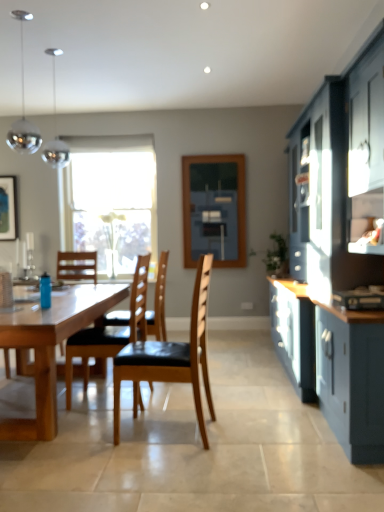
Question: Is brown leather chair at center, positioned as the 3th chair in back-to-front order, further to camera compared to wooden chair with black seat cushion at center, which is the third chair in front-to-back order?

Choices:
 (A) no
 (B) yes

Answer: (A)

Question: Is brown leather chair at center, which is the first chair in front-to-back order, not inside wooden chair with black seat cushion at center, which is the third chair in front-to-back order?

Choices:
 (A) no
 (B) yes

Answer: (B)

Question: From the image's perspective, would you say brown leather chair at center, positioned as the 3th chair in back-to-front order, is shown under wooden chair with black seat cushion at center, the 1th chair from the back?

Choices:
 (A) yes
 (B) no

Answer: (A)

Question: Can you confirm if brown leather chair at center, positioned as the 3th chair in back-to-front order, is taller than wooden chair with black seat cushion at center, which is the third chair in front-to-back order?

Choices:
 (A) no
 (B) yes

Answer: (A)

Question: Is brown leather chair at center, positioned as the 3th chair in back-to-front order, with wooden chair with black seat cushion at center, the 1th chair from the back?

Choices:
 (A) yes
 (B) no

Answer: (B)

Question: Is brown leather chair at center, positioned as the 3th chair in back-to-front order, shorter than wooden chair with black seat cushion at center, which is the third chair in front-to-back order?

Choices:
 (A) no
 (B) yes

Answer: (B)

Question: Is matte black picture frame at upper left smaller than blue matte water bottle at table left?

Choices:
 (A) no
 (B) yes

Answer: (A)

Question: From a real-world perspective, is matte black picture frame at upper left under blue matte water bottle at table left?

Choices:
 (A) no
 (B) yes

Answer: (A)

Question: Is matte black picture frame at upper left next to blue matte water bottle at table left and touching it?

Choices:
 (A) yes
 (B) no

Answer: (B)

Question: Is matte black picture frame at upper left oriented away from blue matte water bottle at table left?

Choices:
 (A) yes
 (B) no

Answer: (B)

Question: Does matte black picture frame at upper left have a greater height compared to blue matte water bottle at table left?

Choices:
 (A) yes
 (B) no

Answer: (A)

Question: From a real-world perspective, is matte black picture frame at upper left positioned over blue matte water bottle at table left based on gravity?

Choices:
 (A) yes
 (B) no

Answer: (A)

Question: Are natural wood table at center and matte black picture frame at upper left beside each other?

Choices:
 (A) no
 (B) yes

Answer: (A)